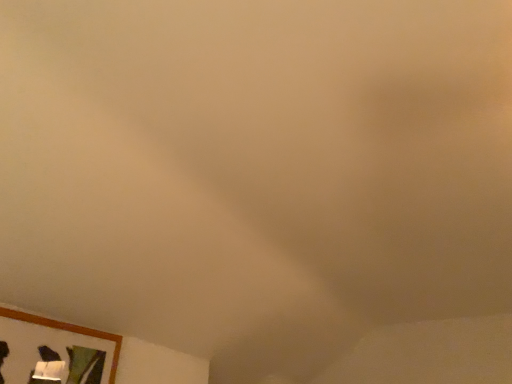
At what (x,y) coordinates should I click in order to perform the action: click on wooden picture frame at lower left. Please return your answer as a coordinate pair (x, y). The image size is (512, 384). Looking at the image, I should click on (54, 351).

What do you see at coordinates (54, 351) in the screenshot?
I see `wooden picture frame at lower left` at bounding box center [54, 351].

At what (x,y) coordinates should I click in order to perform the action: click on wooden picture frame at lower left. Please return your answer as a coordinate pair (x, y). The height and width of the screenshot is (384, 512). Looking at the image, I should click on (54, 351).